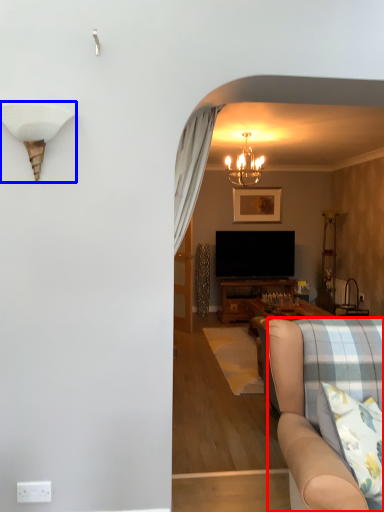
Question: Which object appears farthest to the camera in this image, studio couch (highlighted by a red box) or lamp (highlighted by a blue box)?

Choices:
 (A) studio couch
 (B) lamp

Answer: (B)